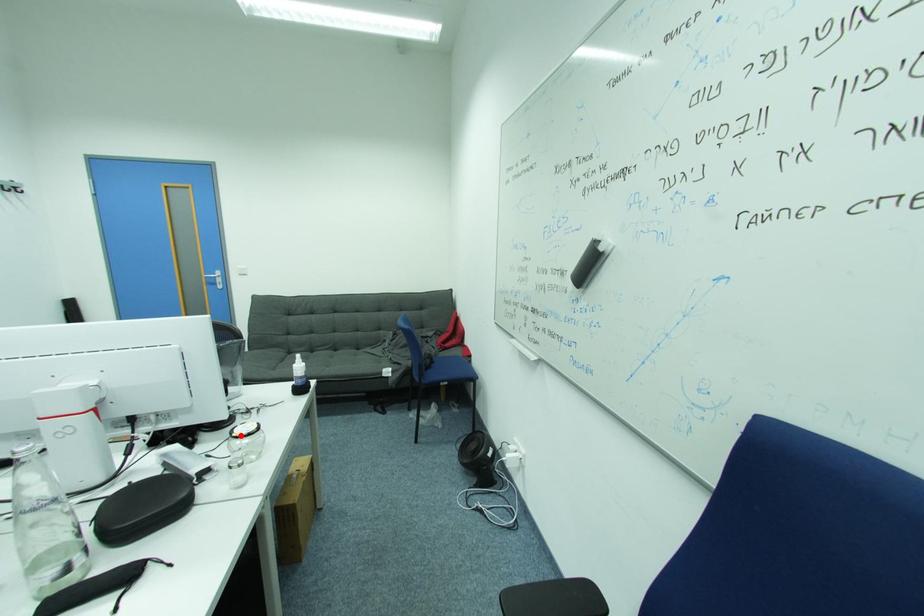
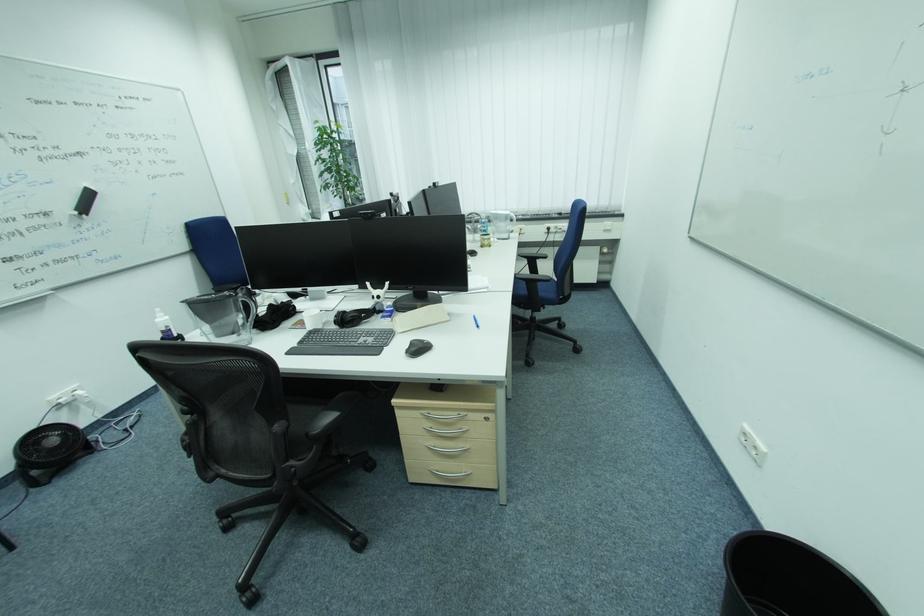
Question: I am providing you with two images of the same scene from different viewpoints. A red point is marked on the first image. At the location where the point appears in image 1, is it still visible in image 2?

Choices:
 (A) Yes
 (B) No

Answer: (B)